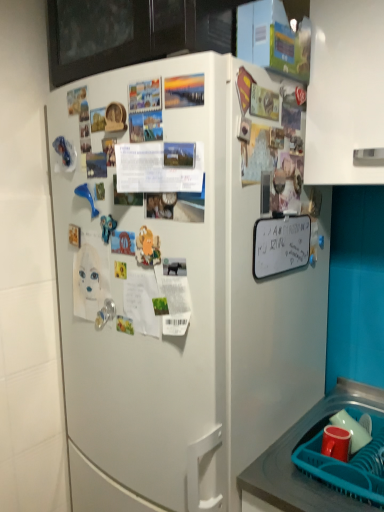
Question: Considering the relative positions of white matte refrigerator at center and matte red cup at lower right in the image provided, is white matte refrigerator at center behind matte red cup at lower right?

Choices:
 (A) no
 (B) yes

Answer: (A)

Question: Is white matte refrigerator at center positioned beyond the bounds of matte red cup at lower right?

Choices:
 (A) no
 (B) yes

Answer: (B)

Question: Is matte red cup at lower right at the back of white matte refrigerator at center?

Choices:
 (A) yes
 (B) no

Answer: (B)

Question: Is white matte refrigerator at center positioned far away from matte red cup at lower right?

Choices:
 (A) yes
 (B) no

Answer: (B)

Question: Is white matte refrigerator at center smaller than matte red cup at lower right?

Choices:
 (A) yes
 (B) no

Answer: (B)

Question: Is matte red cup at lower right a part of white matte refrigerator at center?

Choices:
 (A) no
 (B) yes

Answer: (A)

Question: Is matte red cup at lower right shorter than teal plastic basket at lower right?

Choices:
 (A) yes
 (B) no

Answer: (A)

Question: From the image's perspective, is matte red cup at lower right under teal plastic basket at lower right?

Choices:
 (A) yes
 (B) no

Answer: (B)

Question: Does matte red cup at lower right touch teal plastic basket at lower right?

Choices:
 (A) yes
 (B) no

Answer: (A)

Question: Considering the relative sizes of matte red cup at lower right and teal plastic basket at lower right in the image provided, is matte red cup at lower right bigger than teal plastic basket at lower right?

Choices:
 (A) yes
 (B) no

Answer: (B)

Question: Can you confirm if matte red cup at lower right is thinner than teal plastic basket at lower right?

Choices:
 (A) no
 (B) yes

Answer: (B)

Question: Is matte red cup at lower right taller than teal plastic basket at lower right?

Choices:
 (A) yes
 (B) no

Answer: (B)

Question: Can you confirm if teal plastic basket at lower right is wider than white matte refrigerator at center?

Choices:
 (A) no
 (B) yes

Answer: (A)